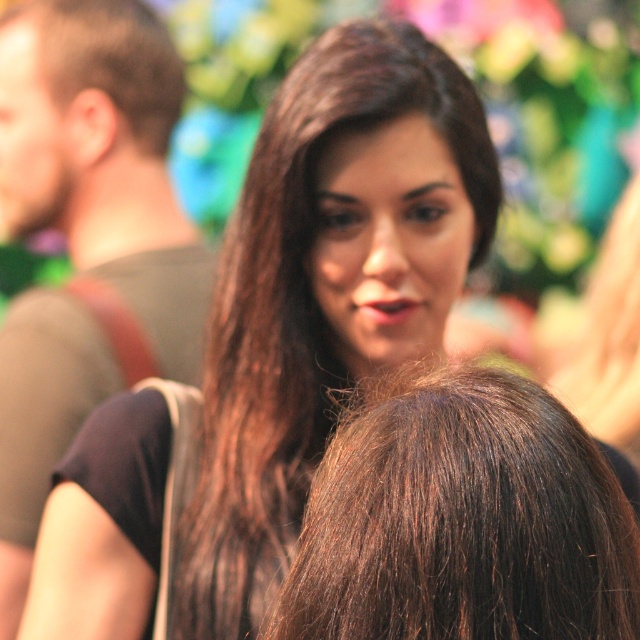
You are a photographer trying to capture a detailed shot of the woman with brown shiny hair at center and the person with brown shiny hair at upper left. Which of these two has hair that takes up more space in the photo?

The brown shiny hair at upper left takes up more space in the photo because it is larger than the brown shiny hair at center.

You are a photographer adjusting your camera settings to capture a detailed shot of the woman in the scene. The camera can only focus on objects within a 3.5 inch range. Given the distance between the brown hair at upper left and brown shiny hair at upper left, will both be in focus?

The distance between the brown hair at upper left and brown shiny hair at upper left is 3.74 inches. Since the camera can only focus on objects within a 3.5 inch range, the two hairs will not both be in focus.